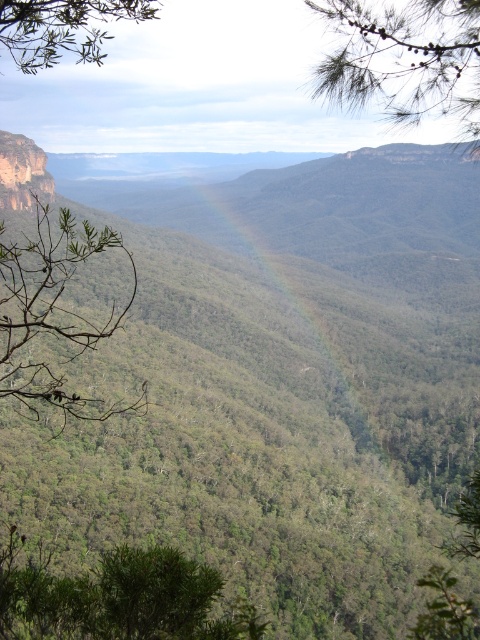
You are standing at the center of the valley and want to locate the green matte pine branch at upper right. Which direction should you look to find it?

You should look towards the upper right direction to find the green matte pine branch at upper right as it is located at point (405,60).

You are standing at the point with coordinates point [151,620] and want to move towards point [207,192]. Given that the terrain in the valley is uneven and rocky, would you say that the path between these two points is likely to be obstructed by natural features?

Point [151,620] is closer to the viewer than point [207,192]. Since the terrain in the valley is described as uneven and rocky with dense greenery, the path between them is likely obstructed by natural features like rocks and vegetation.